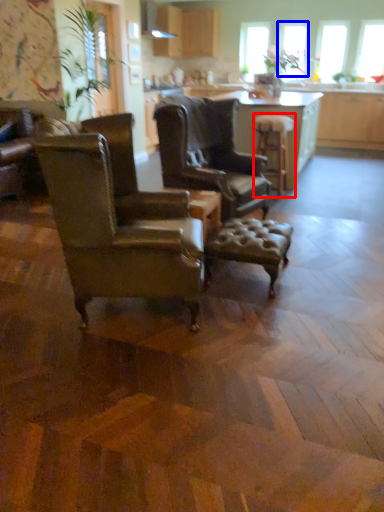
Question: Which object appears farthest to the camera in this image, stool (highlighted by a red box) or window screen (highlighted by a blue box)?

Choices:
 (A) stool
 (B) window screen

Answer: (B)